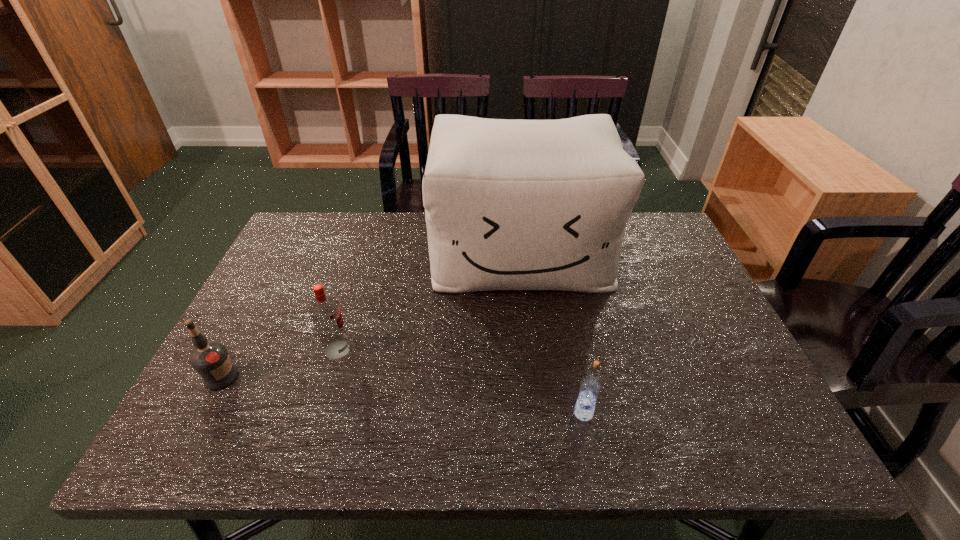
The height and width of the screenshot is (540, 960). Find the location of `free space between the rightmost vodka and the second object from left to right`. free space between the rightmost vodka and the second object from left to right is located at coordinates (461, 381).

Where is `object that can be found as the third closest to the second farthest object`? The height and width of the screenshot is (540, 960). object that can be found as the third closest to the second farthest object is located at coordinates (590, 387).

Locate an element on the screen. object identified as the closest to the nearest object is located at coordinates (518, 204).

Locate which vodka is the second closest to the second farthest vodka. Please provide its 2D coordinates. Your answer should be formatted as a tuple, i.e. [(x, y)], where the tuple contains the x and y coordinates of a point satisfying the conditions above.

[(590, 387)]

Identify which vodka is located as the nearest to the rightmost vodka. Please provide its 2D coordinates. Your answer should be formatted as a tuple, i.e. [(x, y)], where the tuple contains the x and y coordinates of a point satisfying the conditions above.

[(325, 312)]

You are a GUI agent. You are given a task and a screenshot of the screen. Output one action in this format:
    pyautogui.click(x=<x>, y=<y>)
    Task: Click on the vacant space that satisfies the following two spatial constraints: 1. on the front label of the third farthest object; 2. on the left side of the rightmost vodka
    This screenshot has height=540, width=960.
    Given the screenshot: What is the action you would take?
    pyautogui.click(x=203, y=413)

In order to click on blank area in the image that satisfies the following two spatial constraints: 1. on the side of the tallest object with the smiley face; 2. on the front label of the leftmost object in this screenshot , I will do `click(535, 377)`.

Where is `free space in the image that satisfies the following two spatial constraints: 1. on the side of the tallest object with the smiley face; 2. on the front label of the farthest vodka`? free space in the image that satisfies the following two spatial constraints: 1. on the side of the tallest object with the smiley face; 2. on the front label of the farthest vodka is located at coordinates (532, 350).

Find the location of a particular element. blank area in the image that satisfies the following two spatial constraints: 1. on the front label of the farthest vodka; 2. on the left side of the nearest vodka is located at coordinates (318, 413).

You are a GUI agent. You are given a task and a screenshot of the screen. Output one action in this format:
    pyautogui.click(x=<x>, y=<y>)
    Task: Click on the vacant position in the image that satisfies the following two spatial constraints: 1. on the side of the cushion with the smiley face; 2. on the front label of the third farthest object
    
    Given the screenshot: What is the action you would take?
    pyautogui.click(x=535, y=377)